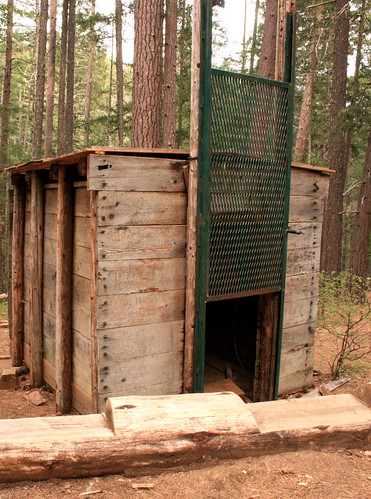
The image size is (371, 499). Find the location of `support beam`. support beam is located at coordinates pos(15,256), pos(38,268), pos(66,295).